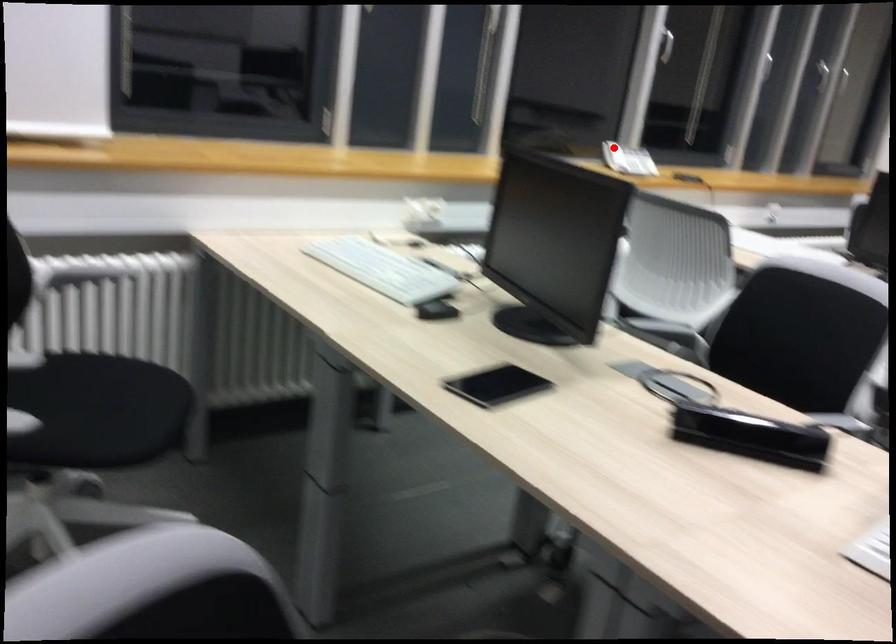
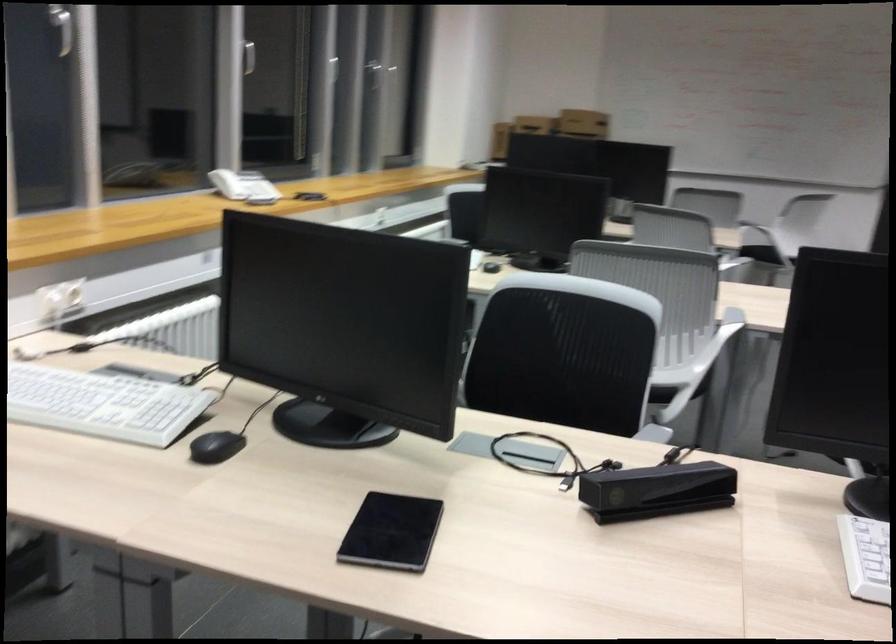
Find the pixel in the second image that matches the highlighted location in the first image.

(227, 184)